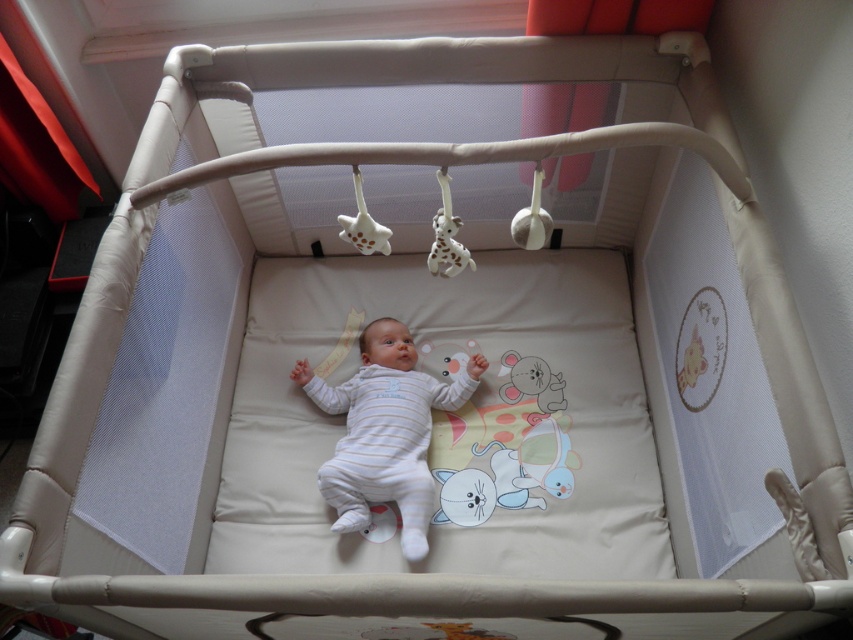
Question: Which point is closer to the camera?

Choices:
 (A) (535, 177)
 (B) (444, 179)
 (C) (366, 221)
 (D) (352, 461)

Answer: (A)

Question: Can you confirm if white matte giraffe at upper center is positioned to the left of white matte plush toy at upper center?

Choices:
 (A) no
 (B) yes

Answer: (B)

Question: Considering the real-world distances, which object is farthest from the white matte plush toy at upper center?

Choices:
 (A) white spotted plastic giraffe at upper center
 (B) white soft baby at center

Answer: (B)

Question: Does white soft baby at center appear on the right side of white spotted plastic giraffe at upper center?

Choices:
 (A) no
 (B) yes

Answer: (A)

Question: Which point is farther to the camera?

Choices:
 (A) (363, 237)
 (B) (393, 477)
 (C) (525, 246)
 (D) (457, 260)

Answer: (B)

Question: Can you confirm if white matte giraffe at upper center is positioned above white matte plush toy at upper center?

Choices:
 (A) yes
 (B) no

Answer: (B)